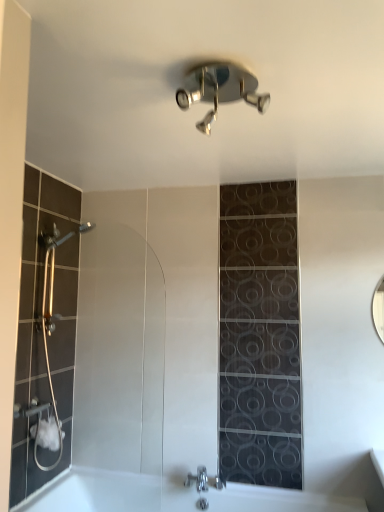
Question: Is white glossy bathtub at lower center inside polished chrome shower at upper center?

Choices:
 (A) yes
 (B) no

Answer: (B)

Question: From the image's perspective, does polished chrome shower at upper center appear lower than white glossy bathtub at lower center?

Choices:
 (A) yes
 (B) no

Answer: (B)

Question: From a real-world perspective, is polished chrome shower at upper center positioned over white glossy bathtub at lower center based on gravity?

Choices:
 (A) yes
 (B) no

Answer: (A)

Question: Is polished chrome shower at upper center at the left side of white glossy bathtub at lower center?

Choices:
 (A) no
 (B) yes

Answer: (A)

Question: Is polished chrome shower at upper center aimed at white glossy bathtub at lower center?

Choices:
 (A) no
 (B) yes

Answer: (A)

Question: Does polished chrome shower at upper center have a greater width compared to white glossy bathtub at lower center?

Choices:
 (A) yes
 (B) no

Answer: (B)

Question: Does white glossy bathtub at lower center have a smaller size compared to chrome metallic faucet at lower center?

Choices:
 (A) no
 (B) yes

Answer: (A)

Question: Can you confirm if white glossy bathtub at lower center is taller than chrome metallic faucet at lower center?

Choices:
 (A) no
 (B) yes

Answer: (B)

Question: Is white glossy bathtub at lower center directly adjacent to chrome metallic faucet at lower center?

Choices:
 (A) yes
 (B) no

Answer: (B)

Question: Considering the relative positions of white glossy bathtub at lower center and chrome metallic faucet at lower center in the image provided, is white glossy bathtub at lower center behind chrome metallic faucet at lower center?

Choices:
 (A) yes
 (B) no

Answer: (B)

Question: From the image's perspective, would you say white glossy bathtub at lower center is positioned over chrome metallic faucet at lower center?

Choices:
 (A) yes
 (B) no

Answer: (B)

Question: From a real-world perspective, is white glossy bathtub at lower center below chrome metallic faucet at lower center?

Choices:
 (A) no
 (B) yes

Answer: (B)

Question: Is chrome metallic faucet at lower center shorter than polished chrome shower at upper center?

Choices:
 (A) no
 (B) yes

Answer: (A)